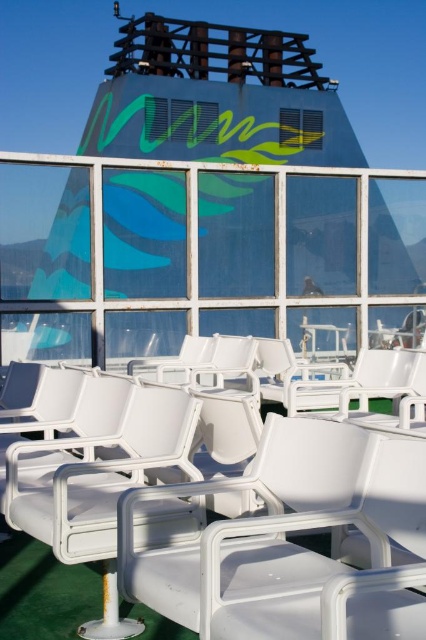
You are a passenger on the ferry and want to sit in the white plastic chairs at center. However, there is already someone sitting in the white plastic chair at center. Which chair should you choose to sit on to be to the left of the occupied chair?

You should choose the white plastic chairs at center because it is to the left of the white plastic chair at center.

You are a passenger on the ferry and want to sit down. You see two options in the image, the white plastic chairs at center and the white plastic chair at center. Which one should you choose if you prefer a seat with higher backrest?

The white plastic chairs at center is much taller as white plastic chair at center, so you should choose the white plastic chairs at center for a higher backrest.